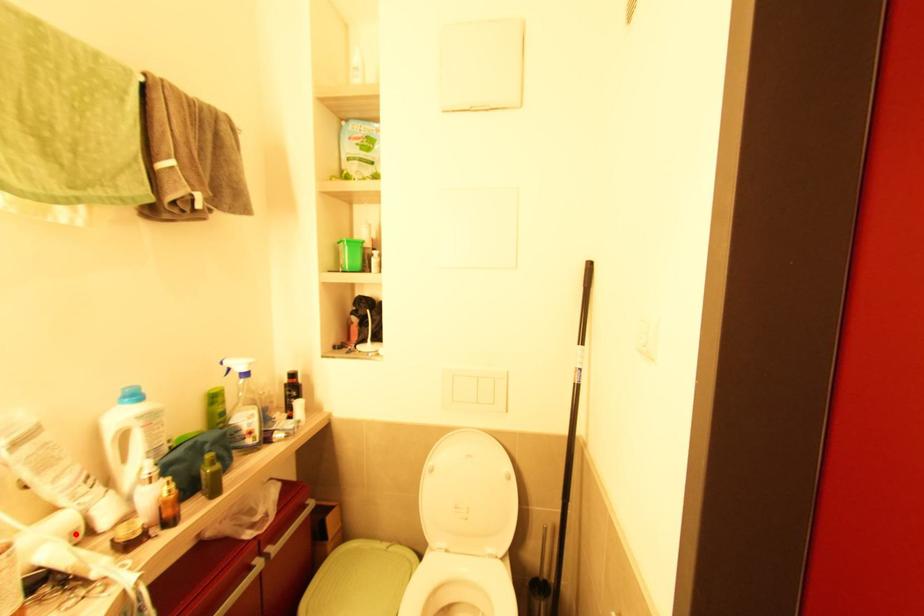
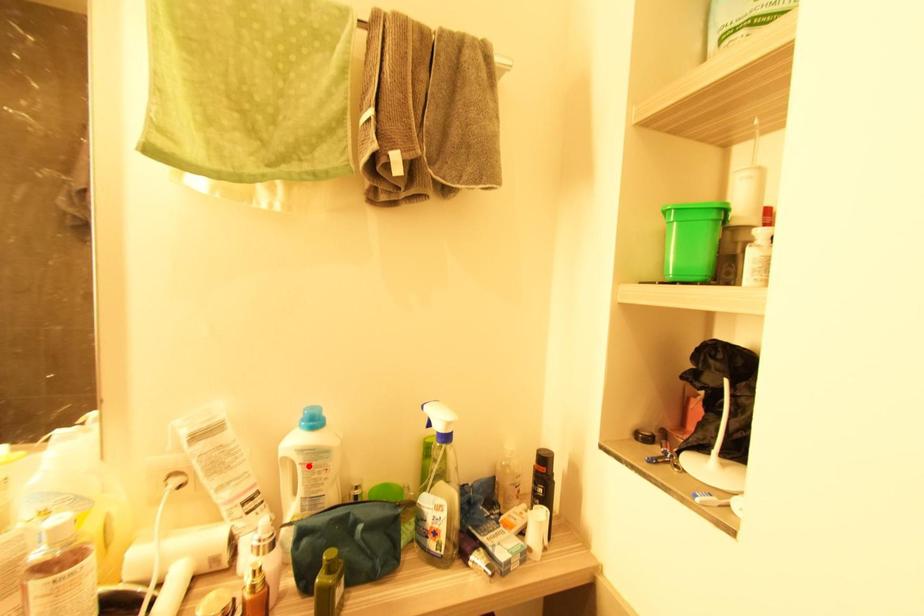
I am providing you with two images of the same scene from different viewpoints. A red point is marked on the first image and another point is marked on the second image. Does the point marked in image1 correspond to the same location as the one in image2?

No